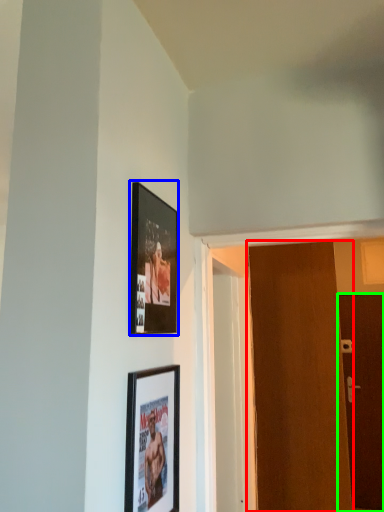
Question: Considering the real-world distances, which object is closest to door (highlighted by a red box)? picture frame (highlighted by a blue box) or door (highlighted by a green box).

Choices:
 (A) picture frame
 (B) door

Answer: (A)